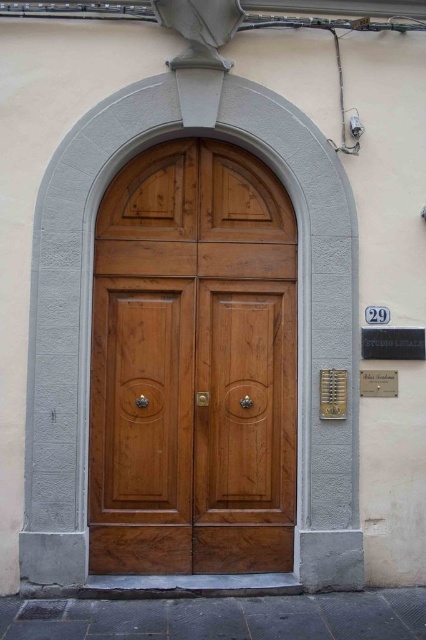
Question: Does walnut wood door at center appear on the left side of metallic gold plaque at right?

Choices:
 (A) yes
 (B) no

Answer: (A)

Question: Is black metal plaque at center right positioned in front of white marble plaque at center?

Choices:
 (A) no
 (B) yes

Answer: (A)

Question: In this image, where is walnut wood door at center located relative to metallic gold plaque at right?

Choices:
 (A) left
 (B) right

Answer: (A)

Question: Which of the following is the farthest from the observer?

Choices:
 (A) metallic gold plaque at right
 (B) walnut wood door at center
 (C) white marble plaque at center

Answer: (C)

Question: Which of the following is the farthest from the observer?

Choices:
 (A) white marble plaque at center
 (B) metallic gold plaque at right
 (C) black metal plaque at center right
 (D) walnut wood door at center

Answer: (C)

Question: Which point is closer to the camera taking this photo?

Choices:
 (A) (328, 403)
 (B) (290, 300)
 (C) (380, 394)
 (D) (417, 342)

Answer: (A)